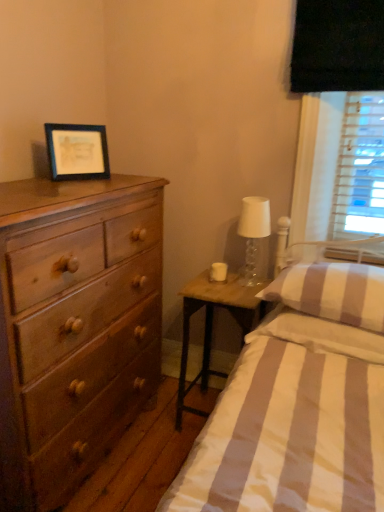
Question: Is there a large distance between matte black picture frame at upper left and translucent glass lampshade at right?

Choices:
 (A) yes
 (B) no

Answer: (B)

Question: Does matte black picture frame at upper left have a lesser width compared to translucent glass lampshade at right?

Choices:
 (A) no
 (B) yes

Answer: (B)

Question: Is matte black picture frame at upper left smaller than translucent glass lampshade at right?

Choices:
 (A) no
 (B) yes

Answer: (B)

Question: Considering the relative sizes of matte black picture frame at upper left and translucent glass lampshade at right in the image provided, is matte black picture frame at upper left shorter than translucent glass lampshade at right?

Choices:
 (A) yes
 (B) no

Answer: (A)

Question: Does matte black picture frame at upper left have a greater width compared to translucent glass lampshade at right?

Choices:
 (A) yes
 (B) no

Answer: (B)

Question: Could you tell me if matte black picture frame at upper left is turned towards translucent glass lampshade at right?

Choices:
 (A) yes
 (B) no

Answer: (B)

Question: From a real-world perspective, is white glass candle holder at right physically below striped fabric pillow at right, which is the 2th pillow in bottom-to-top order?

Choices:
 (A) no
 (B) yes

Answer: (B)

Question: Could you tell me if white glass candle holder at right is turned towards striped fabric pillow at right, which is counted as the first pillow, starting from the top?

Choices:
 (A) no
 (B) yes

Answer: (A)

Question: Are white glass candle holder at right and striped fabric pillow at right, which is the 2th pillow in bottom-to-top order, beside each other?

Choices:
 (A) no
 (B) yes

Answer: (A)

Question: Can you confirm if white glass candle holder at right is thinner than striped fabric pillow at right, which is counted as the first pillow, starting from the top?

Choices:
 (A) no
 (B) yes

Answer: (B)

Question: Is white glass candle holder at right not inside striped fabric pillow at right, which is counted as the first pillow, starting from the top?

Choices:
 (A) yes
 (B) no

Answer: (A)

Question: Is the position of white glass candle holder at right more distant than that of striped fabric pillow at right, which is counted as the first pillow, starting from the top?

Choices:
 (A) no
 (B) yes

Answer: (B)

Question: Is translucent glass lampshade at right wider than woodennightstand at right?

Choices:
 (A) yes
 (B) no

Answer: (B)